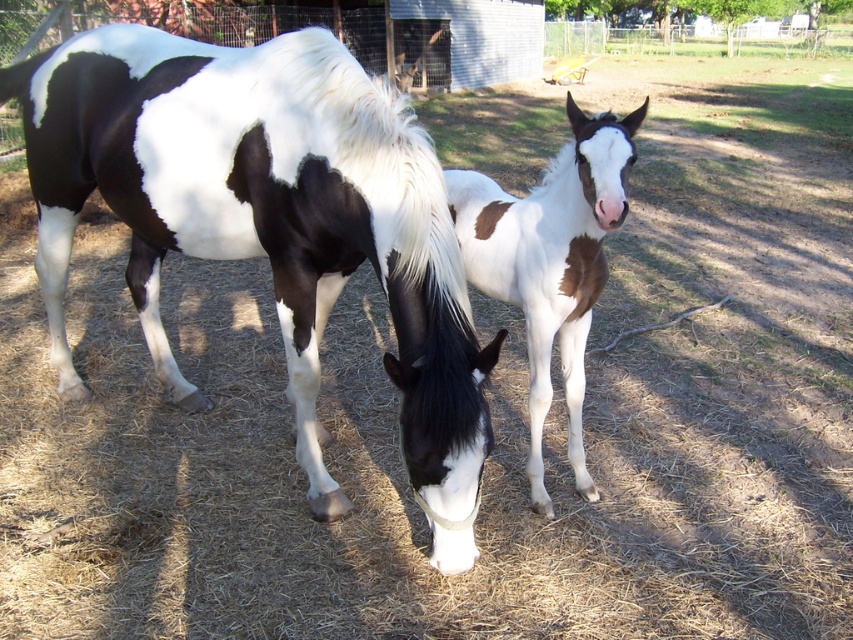
Is point (450, 404) positioned after point (560, 326)?

No, it is not.

You are a GUI agent. You are given a task and a screenshot of the screen. Output one action in this format:
    pyautogui.click(x=<x>, y=<y>)
    Task: Click on the black and white speckled horse at center
    This screenshot has width=853, height=640.
    Given the screenshot: What is the action you would take?
    pyautogui.click(x=268, y=224)

Locate an element on the screen. Image resolution: width=853 pixels, height=640 pixels. black and white speckled horse at center is located at coordinates (268, 224).